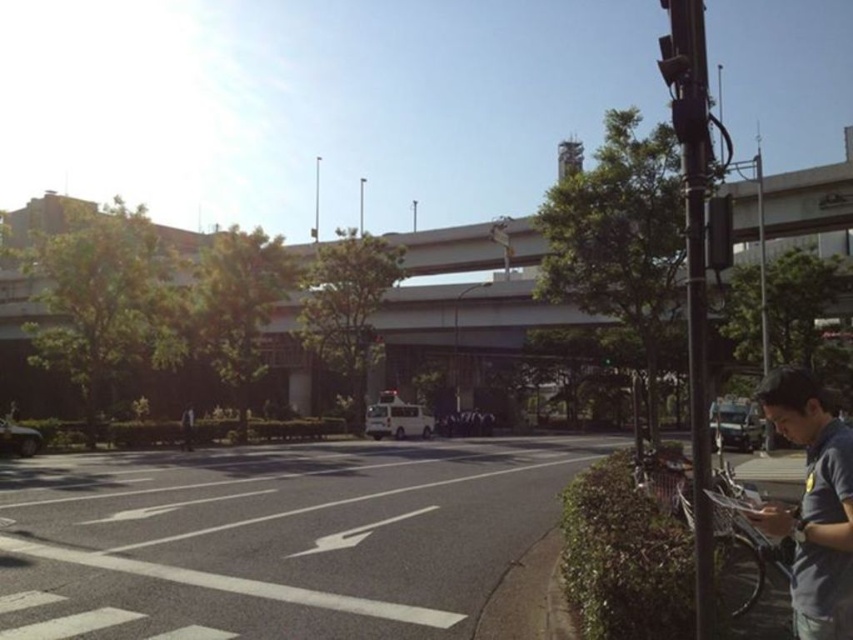
Based on the photo, does gray cotton shirt at lower right have a lesser height compared to dark gray shirt at center?

Correct, gray cotton shirt at lower right is not as tall as dark gray shirt at center.

The image size is (853, 640). What do you see at coordinates (813, 504) in the screenshot?
I see `gray cotton shirt at lower right` at bounding box center [813, 504].

The height and width of the screenshot is (640, 853). What are the coordinates of `gray cotton shirt at lower right` in the screenshot? It's located at (813, 504).

Can you confirm if white asphalt road at center is positioned below gray cotton shirt at lower right?

Indeed, white asphalt road at center is positioned under gray cotton shirt at lower right.

Is point (158, 620) less distant than point (839, 534)?

No, (158, 620) is further to viewer.

Locate an element on the screen. The image size is (853, 640). white asphalt road at center is located at coordinates (276, 538).

Does white asphalt road at center come behind dark gray shirt at center?

That is False.

Is white asphalt road at center thinner than dark gray shirt at center?

No, white asphalt road at center is not thinner than dark gray shirt at center.

Does point (264, 540) come closer to viewer compared to point (183, 440)?

That is True.

Identify the location of white asphalt road at center. (276, 538).